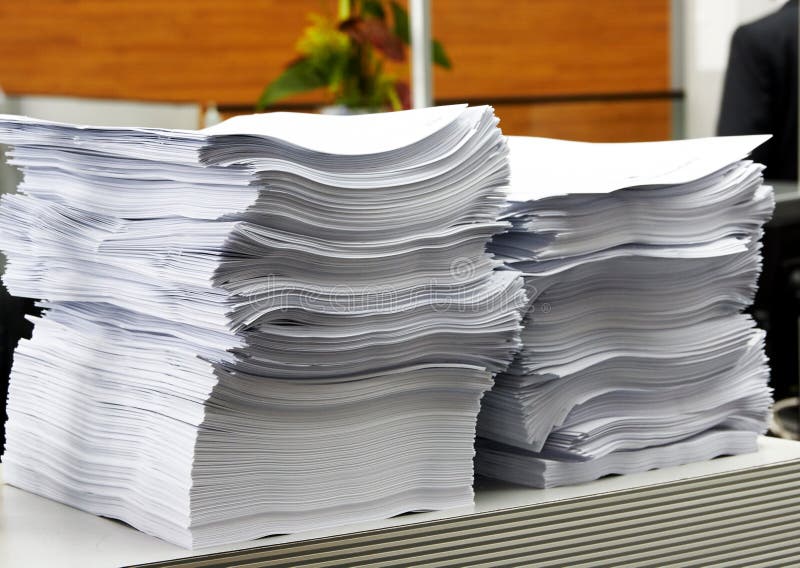
Locate an element on the screen. paper stacks is located at coordinates (670, 236), (313, 384).